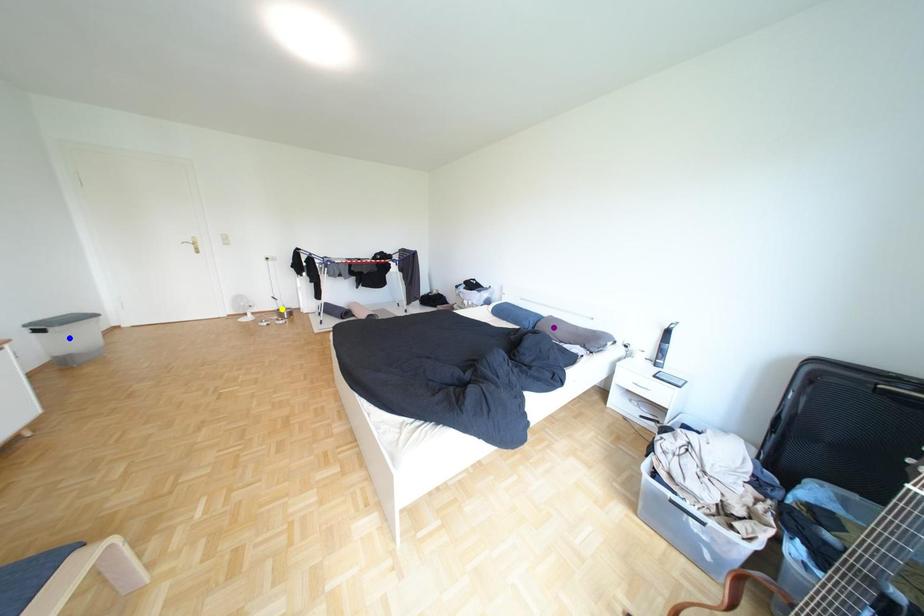
Order these from nearest to farthest:
A) yellow point
B) blue point
C) purple point

blue point → purple point → yellow point